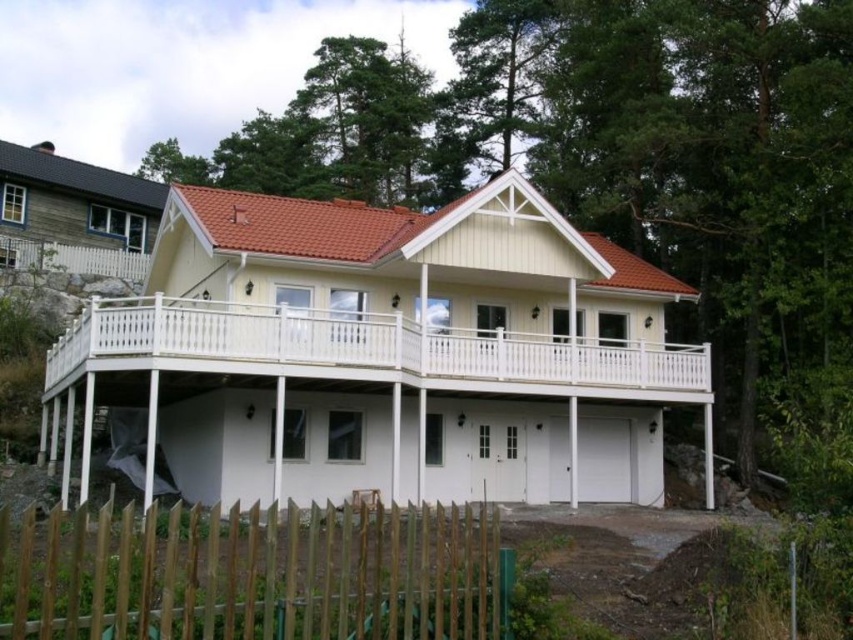
Can you confirm if white painted wood balcony at center is thinner than brown wooden fence at lower left?

No.

Who is shorter, white painted wood balcony at center or brown wooden fence at lower left?

brown wooden fence at lower left

Where is `white painted wood balcony at center`? white painted wood balcony at center is located at coordinates (386, 355).